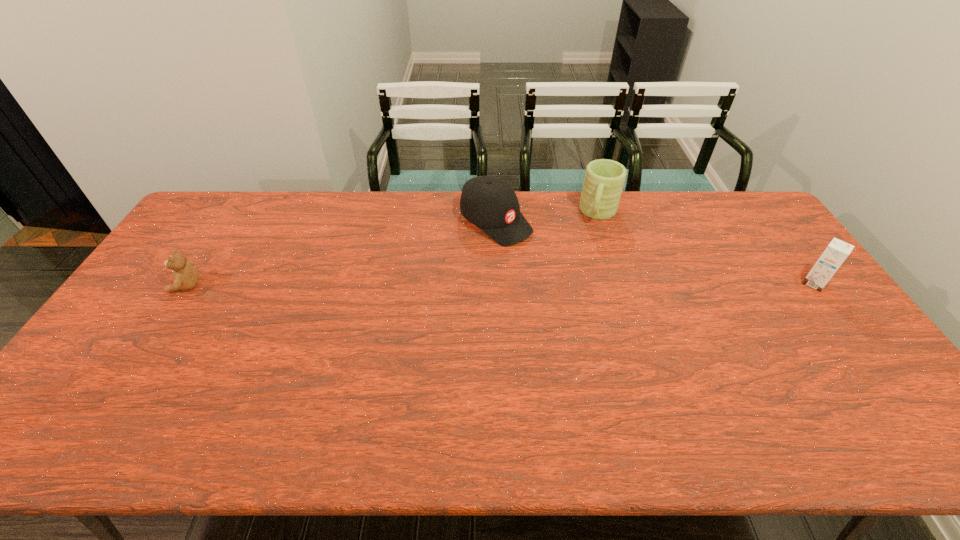
The image size is (960, 540). What are the coordinates of `teddy bear` in the screenshot? It's located at (185, 275).

Image resolution: width=960 pixels, height=540 pixels. Find the location of `chocolate milk`. chocolate milk is located at coordinates (837, 251).

Identify the location of baseball cap. (491, 204).

Identify the location of the third object from left to right. This screenshot has width=960, height=540. (604, 179).

Find the location of a particular element. Image resolution: width=960 pixels, height=540 pixels. vacant space situated on the front-facing side of the leftmost object is located at coordinates (155, 286).

Identify the location of free region located on the front of the chocolate milk. The height and width of the screenshot is (540, 960). (855, 339).

The width and height of the screenshot is (960, 540). In order to click on free spot located with a logo on the front of the second object from left to right in this screenshot , I will do `click(617, 308)`.

This screenshot has height=540, width=960. I want to click on free point located with a logo on the front of the second object from left to right, so click(557, 266).

I want to click on vacant space located 0.280m with a logo on the front of the second object from left to right, so click(x=587, y=287).

Locate an element on the screen. vacant space located on the side of the third object from left to right with the handle is located at coordinates (586, 262).